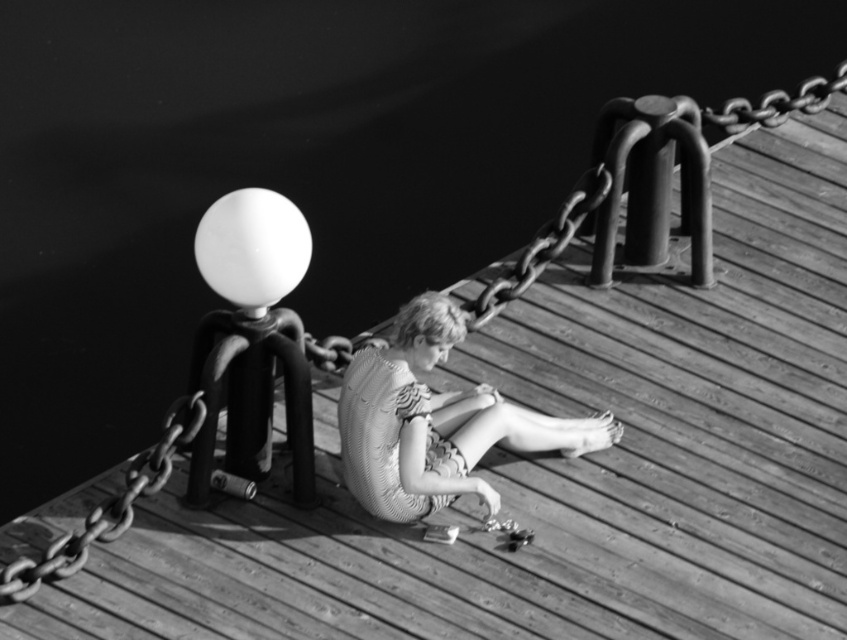
You are a photographer taking a close look at the image. You notice the white matte balloon at upper center and the metallic chain at upper right. Which object appears narrower in the photo?

The white matte balloon at upper center has a lesser width compared to the metallic chain at upper right, so it appears narrower in the photo.